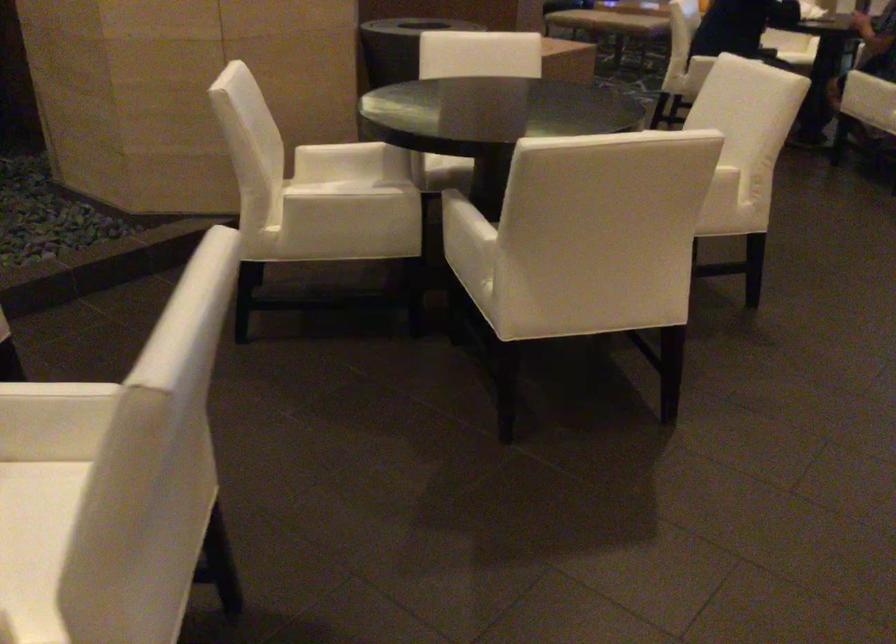
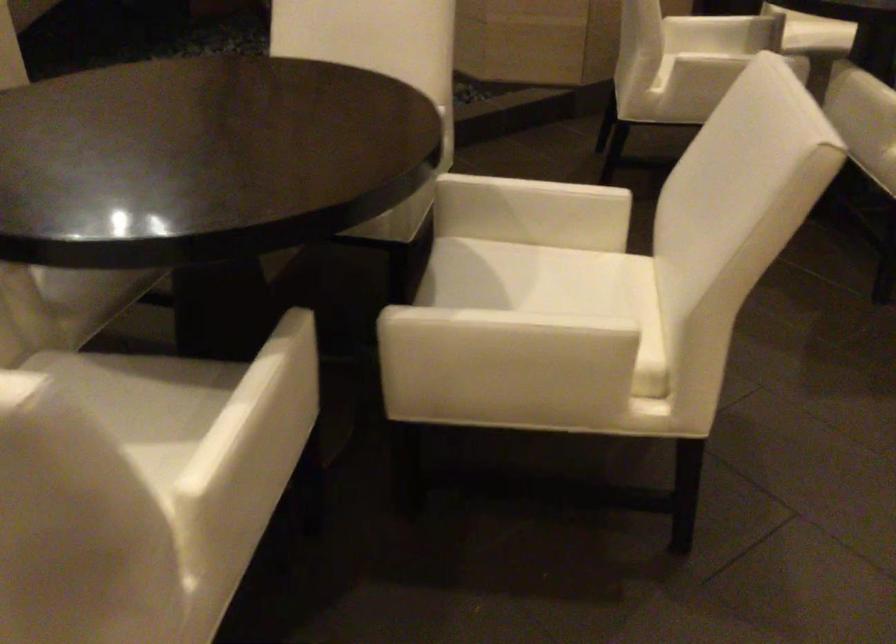
The point at (324, 210) is marked in the first image. Where is the corresponding point in the second image?

(726, 60)